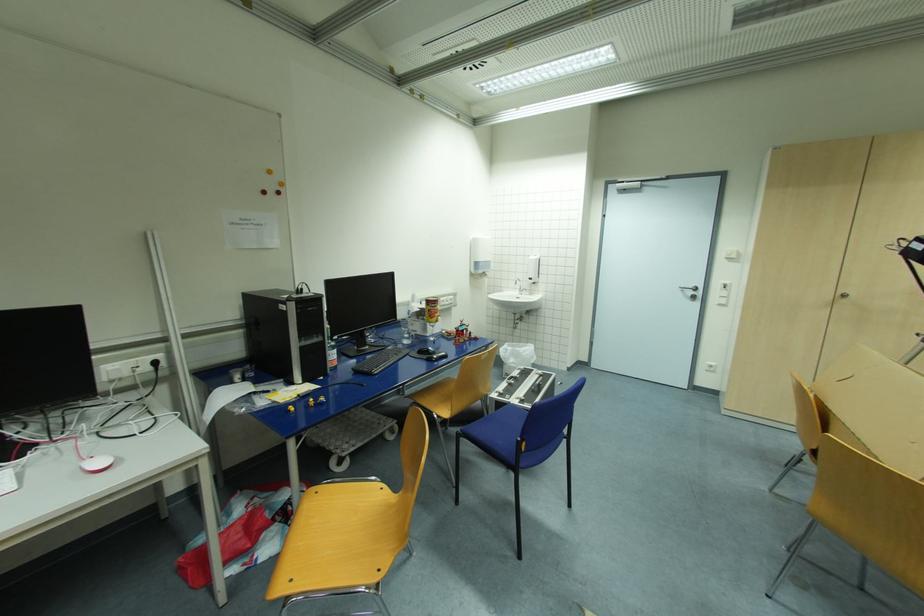
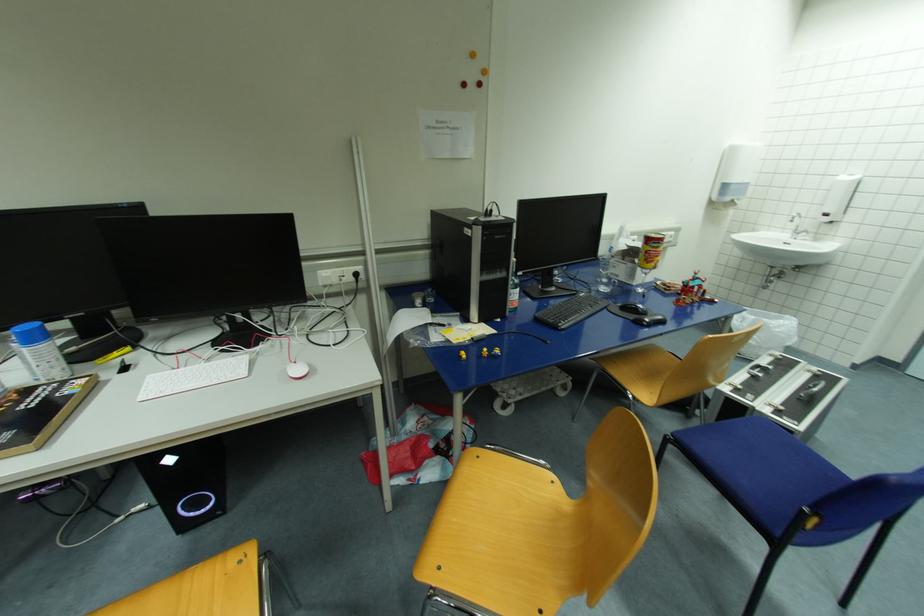
In the second image, find the point that corresponds to pixel 371 375 in the first image.

(557, 329)